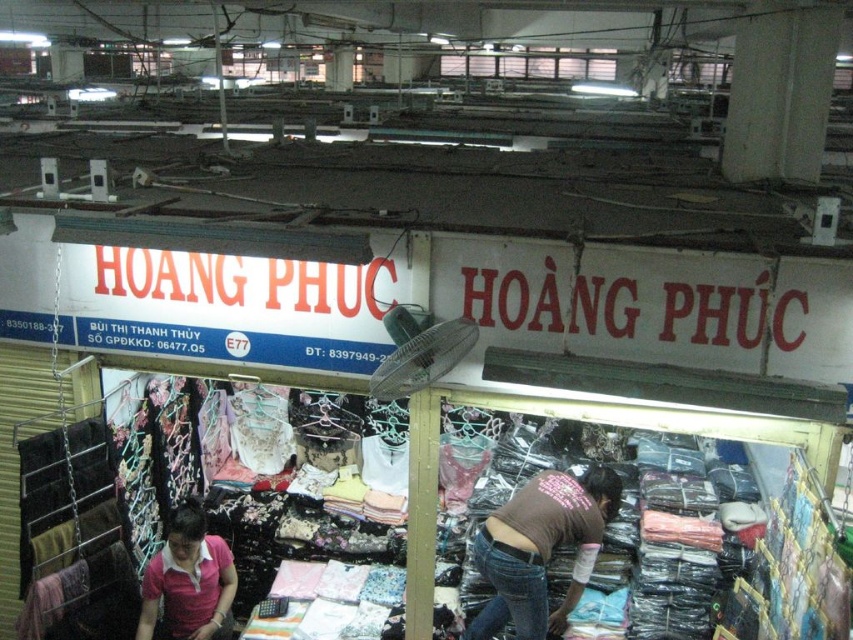
You are a customer at the market stall and want to pick up both the denim jeans at center and the pink cotton polo shirt at lower left. What is the minimum distance you need to walk to collect both items?

The denim jeans at center and the pink cotton polo shirt at lower left are 1.73 meters apart from each other, so the minimum distance you need to walk to collect both items is 1.73 meters.

Consider the image. You are a customer at the market stall and want to find the tallest item between the denim jeans at center and the pink cotton polo shirt at lower left. Which one should you choose?

The denim jeans at center is taller than the pink cotton polo shirt at lower left, so you should choose the denim jeans at center.

You are a customer at the market stall and want to pick up the pink cotton polo shirt at lower left. Are you able to reach it without moving the denim jeans at center?

The denim jeans at center is in front of the pink cotton polo shirt at lower left, so you cannot reach the pink cotton polo shirt at lower left without moving the denim jeans at center.